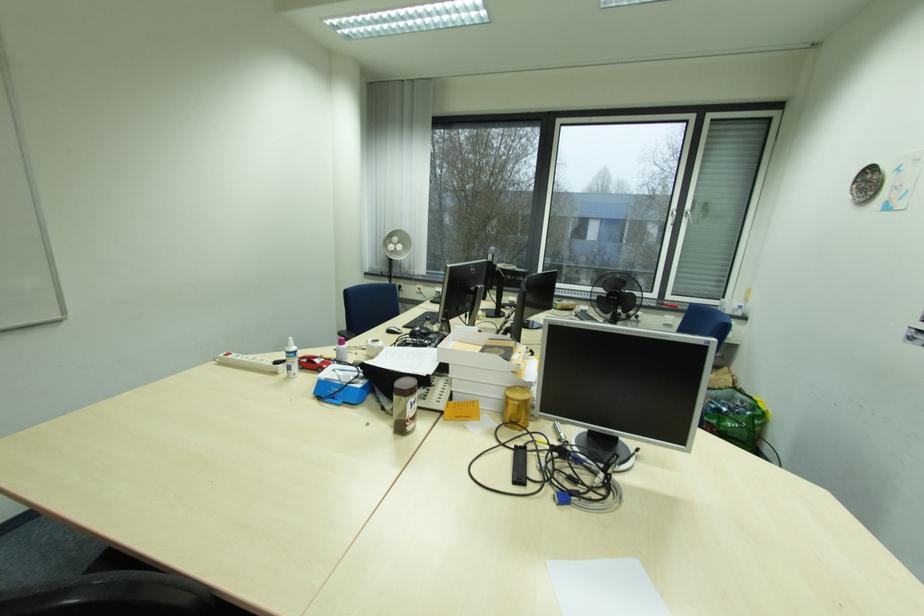
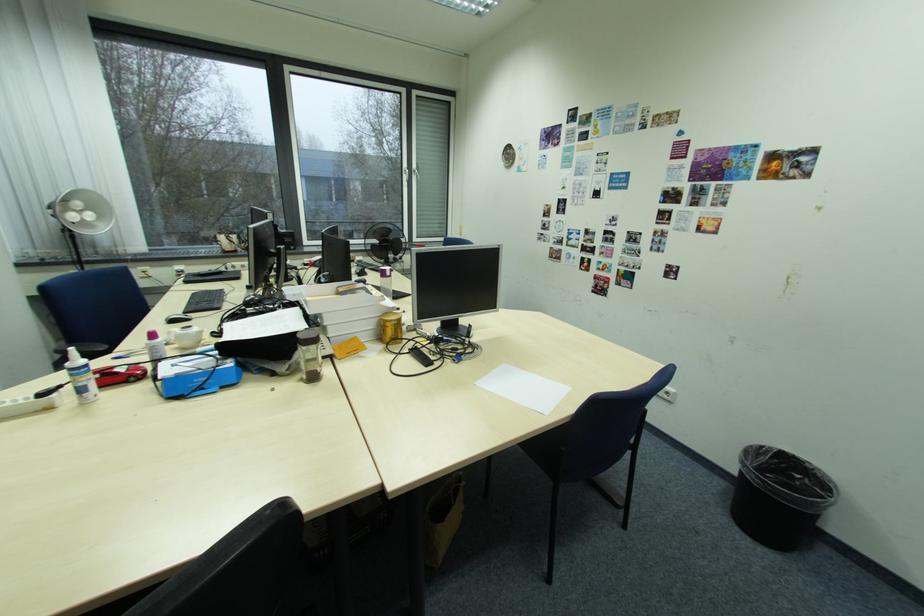
Where in the second image is the point corresponding to [400,428] from the first image?

(310, 381)